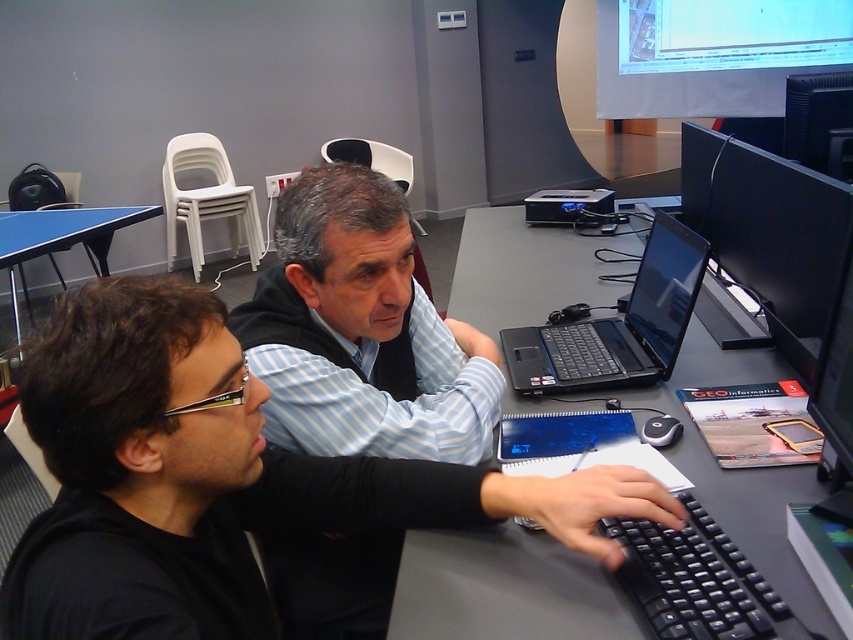
You are trying to set up a new projector on the desk. The projector requires a space of 30 cm in front of the monitor. Is there enough space between the black plastic computer desk at center and the black glossy monitor at upper right to place it?

The black plastic computer desk at center is positioned under the black glossy monitor at upper right, meaning there is vertical space between them rather than horizontal. Since the projector needs space in front of the monitor, the desk being under the monitor suggests there is sufficient horizontal space to place the projector in front of the monitor.

You are standing in front of the desk and want to reach both points on the desk. Which point, point (618, 532) or point (845, 124), is closer to you?

Point (618, 532) is closer to you because it is closer to the camera than point (845, 124).